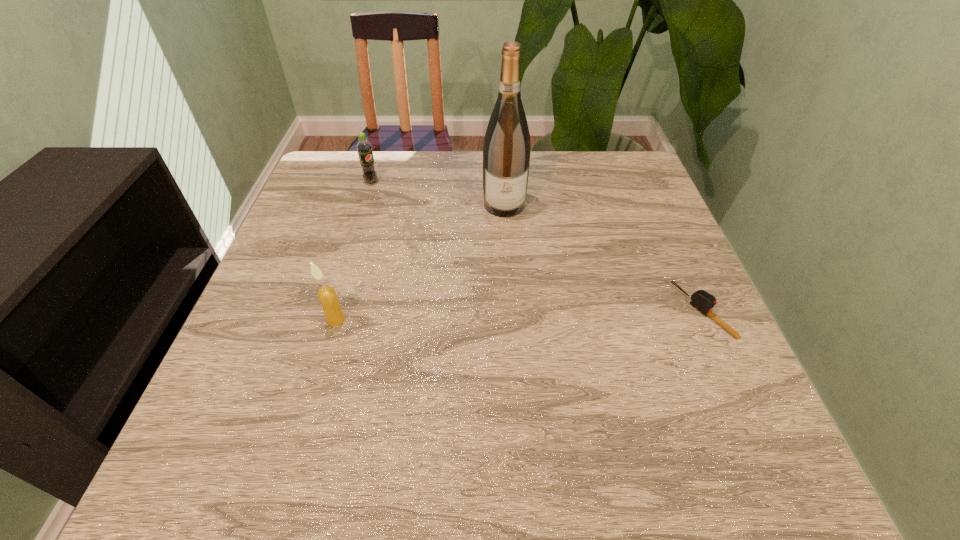
Identify the location of vacant space on the desktop that is between the candle and the tape measure and is positioned on the label of the tallest object. (515, 315).

The image size is (960, 540). What are the coordinates of `vacant space on the desktop that is between the candle and the shortest object and is positioned on the front label of the soda` in the screenshot? It's located at (555, 315).